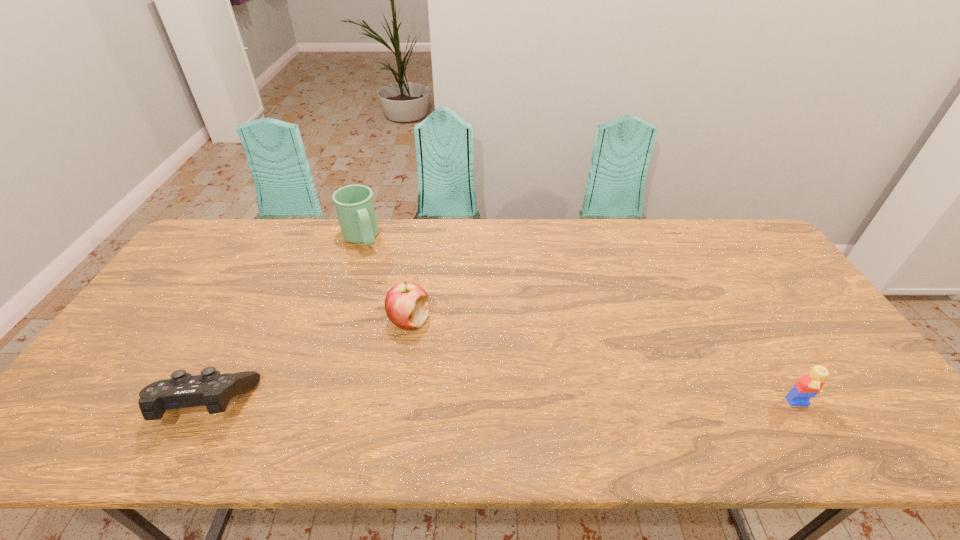
Locate an element on the screen. This screenshot has height=540, width=960. blank area at the far left corner is located at coordinates (204, 261).

In the image, there is a desktop. Find the location of `vacant space at the far right corner`. vacant space at the far right corner is located at coordinates (751, 233).

This screenshot has width=960, height=540. In the image, there is a desktop. Find the location of `vacant region at the near right corner`. vacant region at the near right corner is located at coordinates (864, 410).

Image resolution: width=960 pixels, height=540 pixels. Identify the location of empty space that is in between the third nearest object and the leftmost object. (306, 362).

This screenshot has width=960, height=540. I want to click on free space that is in between the shortest object and the second object from right to left, so click(306, 362).

The height and width of the screenshot is (540, 960). In order to click on unoccupied area between the shortest object and the third object from left to right in this screenshot , I will do `click(306, 362)`.

You are a GUI agent. You are given a task and a screenshot of the screen. Output one action in this format:
    pyautogui.click(x=<x>, y=<y>)
    Task: Click on the free space between the apple and the Lego
    
    Given the screenshot: What is the action you would take?
    click(x=604, y=363)

Locate an element on the screen. free space between the rightmost object and the mug is located at coordinates (580, 322).

You are a GUI agent. You are given a task and a screenshot of the screen. Output one action in this format:
    pyautogui.click(x=<x>, y=<y>)
    Task: Click on the unoccupied area between the third object from left to right and the shortest object
    Image resolution: width=960 pixels, height=540 pixels.
    Given the screenshot: What is the action you would take?
    [x=306, y=362]

The image size is (960, 540). Identify the location of empty space that is in between the second object from right to left and the rightmost object. (604, 363).